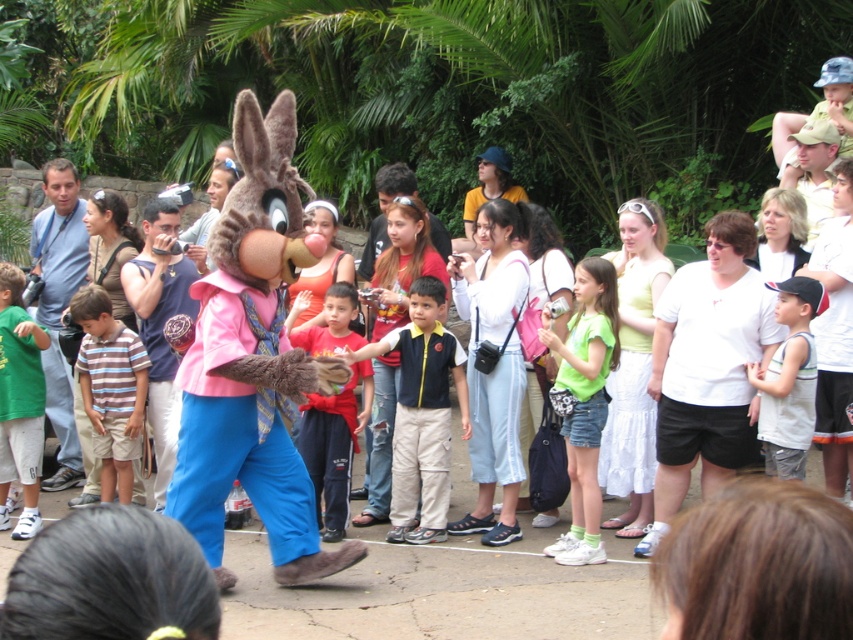
Who is positioned more to the left, velvet plush bunny at center or green denim shorts at center?

Positioned to the left is velvet plush bunny at center.

Find the location of `velvet plush bunny at center`. velvet plush bunny at center is located at coordinates (253, 360).

Describe the element at coordinates (422, 413) in the screenshot. I see `black cotton shirt at center` at that location.

Measure the distance between point (432, 449) and camera.

Point (432, 449) and camera are 8.06 meters apart.

Image resolution: width=853 pixels, height=640 pixels. Describe the element at coordinates (422, 413) in the screenshot. I see `black cotton shirt at center` at that location.

Identify the location of black cotton shirt at center. The height and width of the screenshot is (640, 853). (422, 413).

Does black cotton shirt at center appear over white cotton tank top at center?

Incorrect, black cotton shirt at center is not positioned above white cotton tank top at center.

Is point (440, 451) behind point (798, 336)?

Yes, it is behind point (798, 336).

At what (x,y) coordinates should I click in order to perform the action: click on black cotton shirt at center. Please return your answer as a coordinate pair (x, y). Looking at the image, I should click on (422, 413).